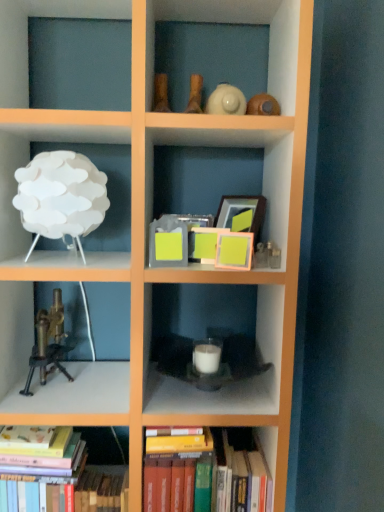
Question: Can we say brass/bronze microscope at left lies outside white matte candle at center, the second shelf when ordered from left to right?

Choices:
 (A) no
 (B) yes

Answer: (B)

Question: Is brass/bronze microscope at left surrounding white matte candle at center, marked as the 1th shelf in a right-to-left arrangement?

Choices:
 (A) yes
 (B) no

Answer: (B)

Question: From the image's perspective, is brass/bronze microscope at left located above white matte candle at center, marked as the 1th shelf in a right-to-left arrangement?

Choices:
 (A) yes
 (B) no

Answer: (A)

Question: Is brass/bronze microscope at left not near white matte candle at center, the second shelf when ordered from left to right?

Choices:
 (A) yes
 (B) no

Answer: (B)

Question: Does brass/bronze microscope at left come in front of white matte candle at center, the second shelf when ordered from left to right?

Choices:
 (A) yes
 (B) no

Answer: (B)

Question: Is white matte lamp at upper left, placed as the second shelf when sorted from bottom to top, bigger or smaller than hardcover books at lower left, positioned as the first book in left-to-right order?

Choices:
 (A) big
 (B) small

Answer: (B)

Question: From the image's perspective, relative to hardcover books at lower left, acting as the 2th book starting from the right, is white matte lamp at upper left, placed as the second shelf when sorted from bottom to top, above or below?

Choices:
 (A) above
 (B) below

Answer: (A)

Question: Based on their positions, is white matte lamp at upper left, which ranks as the 1th shelf in left-to-right order, located to the left or right of hardcover books at lower left, positioned as the first book in left-to-right order?

Choices:
 (A) left
 (B) right

Answer: (B)

Question: In the image, is white matte lamp at upper left, which is the 2th shelf in right-to-left order, positioned in front of or behind hardcover books at lower left, acting as the 2th book starting from the right?

Choices:
 (A) front
 (B) behind

Answer: (A)

Question: Do you think brass/bronze microscope at left is within white matte candle at center, the first shelf ordered from the bottom, or outside of it?

Choices:
 (A) inside
 (B) outside

Answer: (B)

Question: From the image's perspective, is brass/bronze microscope at left located above or below white matte candle at center, the first shelf ordered from the bottom?

Choices:
 (A) below
 (B) above

Answer: (B)

Question: Is point (61, 348) closer or farther from the camera than point (180, 295)?

Choices:
 (A) farther
 (B) closer

Answer: (B)

Question: Considering the positions of brass/bronze microscope at left and white matte candle at center, the first shelf ordered from the bottom, in the image, is brass/bronze microscope at left wider or thinner than white matte candle at center, the first shelf ordered from the bottom,?

Choices:
 (A) thin
 (B) wide

Answer: (A)

Question: Would you say hardcover books at lower left, positioned as the first book in left-to-right order, is inside or outside hardcover books at center, the second book viewed from the left?

Choices:
 (A) inside
 (B) outside

Answer: (B)

Question: Relative to hardcover books at center, the second book viewed from the left, is hardcover books at lower left, positioned as the first book in left-to-right order, in front or behind?

Choices:
 (A) behind
 (B) front

Answer: (B)